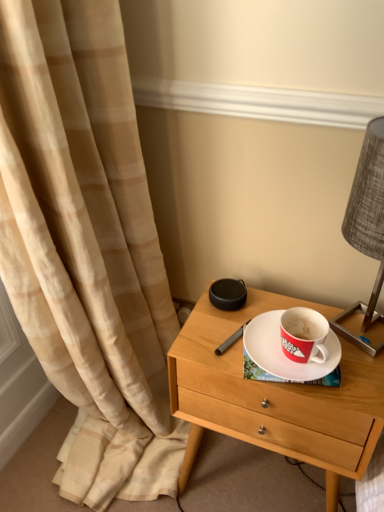
Find the location of a particular element. free space above light wood/finish nightstand at center (from a real-world perspective) is located at coordinates (272, 340).